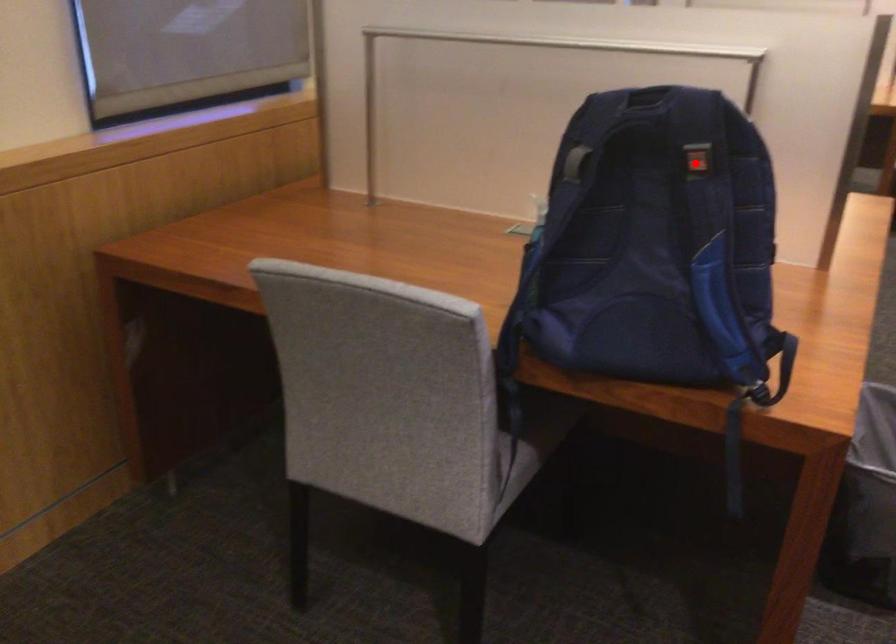
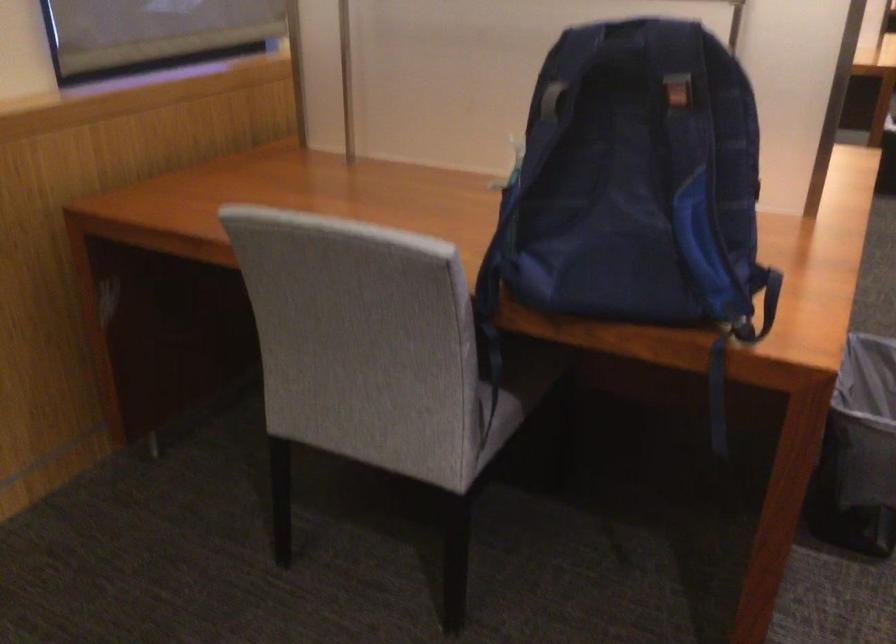
The point at the highlighted location is marked in the first image. Where is the corresponding point in the second image?

(677, 93)